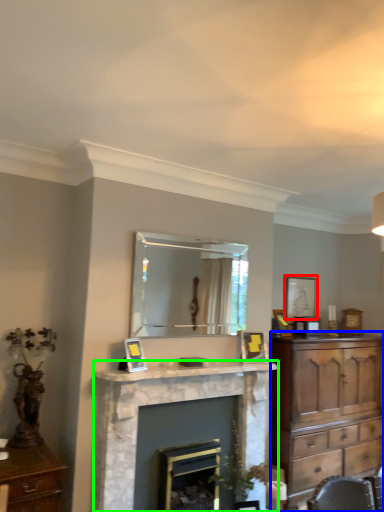
Question: Considering the real-world distances, which object is farthest from picture frame (highlighted by a red box)? chest of drawers (highlighted by a blue box) or fireplace (highlighted by a green box)?

Choices:
 (A) chest of drawers
 (B) fireplace

Answer: (B)